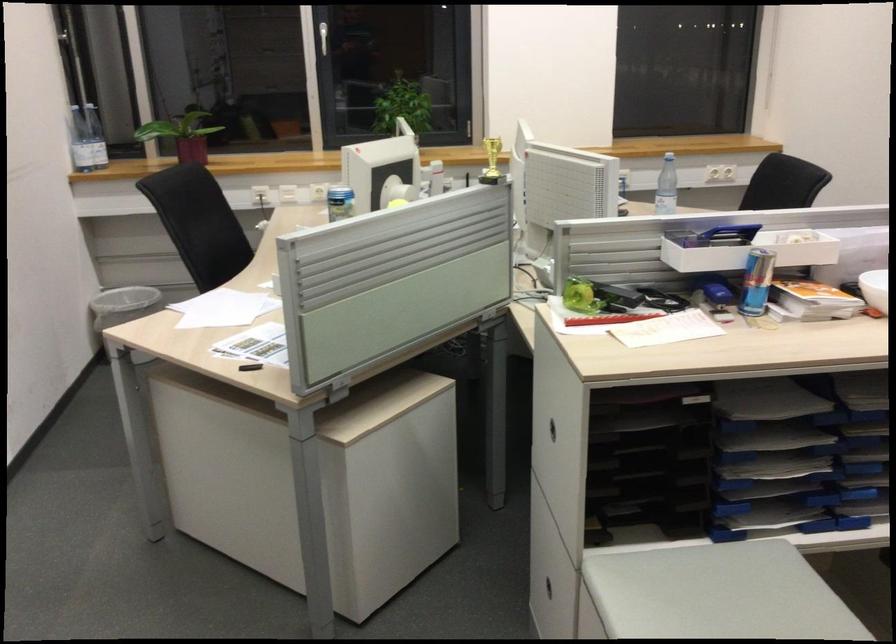
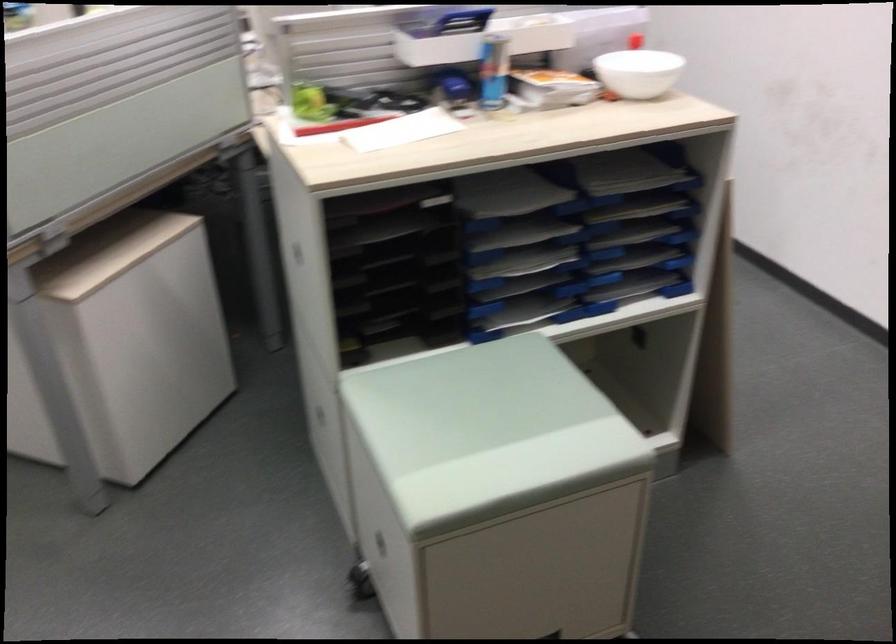
The images are taken continuously from a first-person perspective. In which direction are you moving?

The movement direction of the cameraman is right, forward.